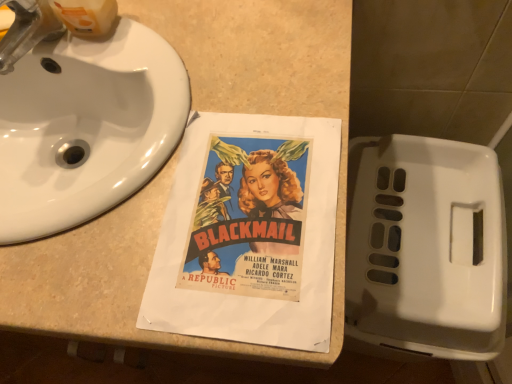
In order to face white glossy sink at upper left, should I rotate leftwards or rightwards?

You should look left and rotate roughly 24.140 degrees.

What is the approximate width of beige laminate counter at center?

62.80 centimeters.

The image size is (512, 384). What are the coordinates of `white plastic toilet at lower right` in the screenshot? It's located at 425,249.

What's the angular difference between brushed metal faucet at upper left and white glossy sink at upper left's facing directions?

3e-05 degrees.

Which of these two, brushed metal faucet at upper left or white glossy sink at upper left, is thinner?

With smaller width is brushed metal faucet at upper left.

Which of these two, brushed metal faucet at upper left or white glossy sink at upper left, stands shorter?

brushed metal faucet at upper left is shorter.

From the picture: Which is closer, (3,65) or (45,46)?

Point (3,65) appears to be closer to the viewer than point (45,46).

Looking at this image, from the image's perspective, who appears lower, white glossy sink at upper left or beige laminate counter at center?

beige laminate counter at center, from the image's perspective.

From a real-world perspective, is white glossy sink at upper left on beige laminate counter at center?

Indeed, from a real-world perspective, white glossy sink at upper left stands above beige laminate counter at center.

Is there a large distance between white glossy sink at upper left and beige laminate counter at center?

They are positioned close to each other.

Which of these two, white glossy sink at upper left or beige laminate counter at center, is bigger?

Bigger between the two is beige laminate counter at center.

Is point (228, 24) closer or farther from the camera than point (464, 252)?

Point (228, 24) is closer to the camera than point (464, 252).

Is beige laminate counter at center situated inside white plastic toilet at lower right or outside?

The correct answer is: outside.

How much distance is there between beige laminate counter at center and white plastic toilet at lower right?

They are 37.15 centimeters apart.

From the image's perspective, which is below, beige laminate counter at center or white plastic toilet at lower right?

white plastic toilet at lower right, from the image's perspective.

From the image's perspective, is beige laminate counter at center under white glossy sink at upper left?

Yes.

Considering the relative sizes of beige laminate counter at center and white glossy sink at upper left in the image provided, is beige laminate counter at center smaller than white glossy sink at upper left?

No.

Is the depth of beige laminate counter at center greater than that of white glossy sink at upper left?

No, beige laminate counter at center is closer to the viewer.

From the picture: Can you confirm if beige laminate counter at center is positioned to the left of white glossy sink at upper left?

Yes.

Between white plastic toilet at lower right and beige laminate counter at center, which one has smaller width?

Thinner between the two is white plastic toilet at lower right.

From the image's perspective, which is below, white plastic toilet at lower right or beige laminate counter at center?

white plastic toilet at lower right.

Is white plastic toilet at lower right looking in the opposite direction of beige laminate counter at center?

No, white plastic toilet at lower right is not facing the opposite direction of beige laminate counter at center.

Is there a large distance between brushed metal faucet at upper left and beige laminate counter at center?

brushed metal faucet at upper left is near beige laminate counter at center, not far away.

Which object is closer to the camera taking this photo, brushed metal faucet at upper left or beige laminate counter at center?

beige laminate counter at center.

Does brushed metal faucet at upper left turn towards beige laminate counter at center?

No, brushed metal faucet at upper left does not turn towards beige laminate counter at center.

From the image's perspective, which is above, white glossy sink at upper left or brushed metal faucet at upper left?

brushed metal faucet at upper left appears higher in the image.

Consider the image. Considering the positions of objects white glossy sink at upper left and brushed metal faucet at upper left in the image provided, who is more to the right, white glossy sink at upper left or brushed metal faucet at upper left?

white glossy sink at upper left is more to the right.

Does white glossy sink at upper left lie behind brushed metal faucet at upper left?

No, white glossy sink at upper left is closer to the viewer.

Is white glossy sink at upper left not within brushed metal faucet at upper left?

Yes, white glossy sink at upper left is located beyond the bounds of brushed metal faucet at upper left.

Locate an element on the screen. faucet behind the white glossy sink at upper left is located at coordinates click(x=27, y=30).

The width and height of the screenshot is (512, 384). I want to click on counter top that appears in front of the white glossy sink at upper left, so click(175, 167).

Estimate the real-world distances between objects in this image. Which object is further from beige laminate counter at center, white plastic toilet at lower right or white glossy sink at upper left?

white plastic toilet at lower right.

Looking at the image, which one is located closer to white plastic toilet at lower right, beige laminate counter at center or white glossy sink at upper left?

beige laminate counter at center is positioned closer to the anchor white plastic toilet at lower right.

Considering their positions, is brushed metal faucet at upper left positioned further to white plastic toilet at lower right than white glossy sink at upper left?

brushed metal faucet at upper left.

When comparing their distances from white plastic toilet at lower right, does brushed metal faucet at upper left or beige laminate counter at center seem further?

brushed metal faucet at upper left.

Which object lies nearer to the anchor point white glossy sink at upper left, white plastic toilet at lower right or beige laminate counter at center?

beige laminate counter at center is closer to white glossy sink at upper left.

Looking at the image, which one is located further to beige laminate counter at center, white glossy sink at upper left or white plastic toilet at lower right?

white plastic toilet at lower right.

From the image, which object appears to be farther from white plastic toilet at lower right, beige laminate counter at center or brushed metal faucet at upper left?

Among the two, brushed metal faucet at upper left is located further to white plastic toilet at lower right.

When comparing their distances from beige laminate counter at center, does brushed metal faucet at upper left or white glossy sink at upper left seem further?

brushed metal faucet at upper left is further to beige laminate counter at center.

Locate an element on the screen. faucet located between beige laminate counter at center and white plastic toilet at lower right in the left-right direction is located at coordinates (27, 30).

You are a GUI agent. You are given a task and a screenshot of the screen. Output one action in this format:
    pyautogui.click(x=<x>, y=<y>)
    Task: Click on the sink between beige laminate counter at center and white plastic toilet at lower right in the horizontal direction
    Image resolution: width=512 pixels, height=384 pixels.
    Given the screenshot: What is the action you would take?
    pyautogui.click(x=81, y=121)

Where is `sink between brushed metal faucet at upper left and white plastic toilet at lower right from left to right`? sink between brushed metal faucet at upper left and white plastic toilet at lower right from left to right is located at coordinates (81, 121).

Locate an element on the screen. The height and width of the screenshot is (384, 512). sink between brushed metal faucet at upper left and beige laminate counter at center from top to bottom is located at coordinates (81, 121).